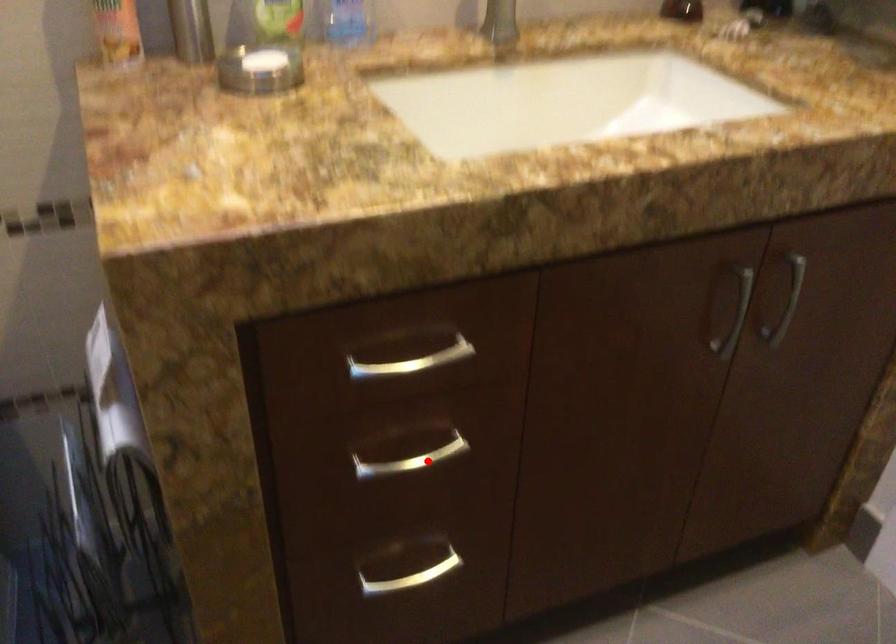
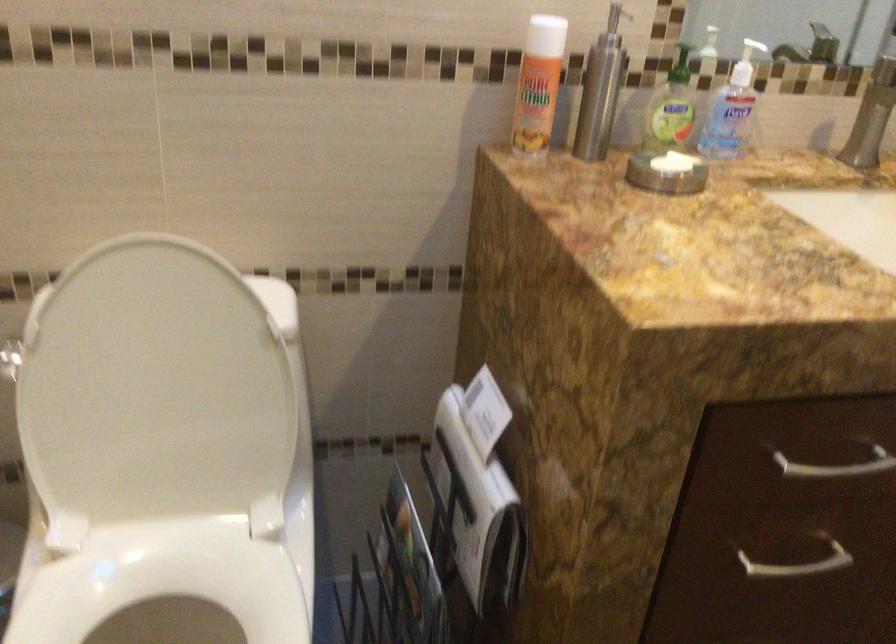
Where in the second image is the point corresponding to the highlighted location from the first image?

(797, 565)